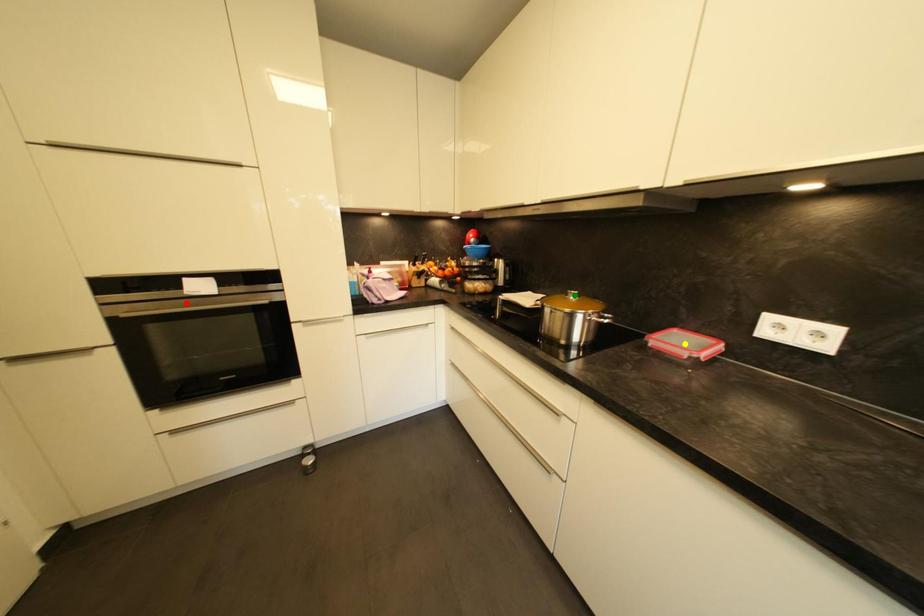
Order these from farthest to nearest:
- yellow point
- red point
- green point

1. red point
2. green point
3. yellow point